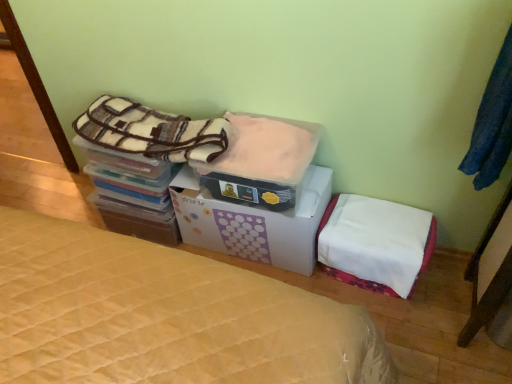
You are a GUI agent. You are given a task and a screenshot of the screen. Output one action in this format:
    pyautogui.click(x=<x>, y=<y>)
    Task: Click on the white cardboard box at center
    
    Given the screenshot: What is the action you would take?
    pyautogui.click(x=254, y=222)

What do you see at coordinates (151, 131) in the screenshot? I see `plush fleece blanket at upper left, which is counted as the first blanket, starting from the left` at bounding box center [151, 131].

This screenshot has width=512, height=384. In order to click on white cardboard box at center in this screenshot , I will do `click(254, 222)`.

Considering the sizes of objects white cardboard box at center and white fabric mattress at lower right in the image provided, who is smaller, white cardboard box at center or white fabric mattress at lower right?

white fabric mattress at lower right.

From a real-world perspective, which is physically above, white cardboard box at center or white fabric mattress at lower right?

white cardboard box at center, from a real-world perspective.

Considering the positions of points (190, 239) and (396, 211), is point (190, 239) closer to camera compared to point (396, 211)?

No, (190, 239) is behind (396, 211).

Would you say white fabric mattress at lower right is part of white cardboard box at center's contents?

That's incorrect, white fabric mattress at lower right is not inside white cardboard box at center.

From the image's perspective, would you say dark blue fabric at upper right is positioned over white cardboard box at center?

Yes, from the image's perspective, dark blue fabric at upper right is over white cardboard box at center.

From a real-world perspective, is dark blue fabric at upper right physically located above or below white cardboard box at center?

In terms of real-world spatial position, dark blue fabric at upper right is above white cardboard box at center.

Between dark blue fabric at upper right and white cardboard box at center, which one has smaller size?

Smaller between the two is dark blue fabric at upper right.

Does dark blue fabric at upper right appear on the right side of white cardboard box at center?

Correct, you'll find dark blue fabric at upper right to the right of white cardboard box at center.

Is white cardboard box at center in front of plush fleece blanket at upper left, the 2th blanket from the right?

No, it is not.

Considering the relative sizes of white cardboard box at center and plush fleece blanket at upper left, which is counted as the first blanket, starting from the left, in the image provided, is white cardboard box at center shorter than plush fleece blanket at upper left, which is counted as the first blanket, starting from the left,?

No, white cardboard box at center is not shorter than plush fleece blanket at upper left, which is counted as the first blanket, starting from the left.

From the image's perspective, is white cardboard box at center positioned above or below plush fleece blanket at upper left, which is counted as the first blanket, starting from the left?

Clearly, from the image's perspective, white cardboard box at center is below plush fleece blanket at upper left, which is counted as the first blanket, starting from the left.

Can you tell me how much white cardboard box at center and plush fleece blanket at upper left, the 2th blanket from the right, differ in facing direction?

There is a 0.000684-degree angle between the facing directions of white cardboard box at center and plush fleece blanket at upper left, the 2th blanket from the right.

Based on the photo, can you confirm if white cardboard box at center is smaller than dark blue fabric at upper right?

Actually, white cardboard box at center might be larger than dark blue fabric at upper right.

Based on the photo, considering the sizes of white cardboard box at center and dark blue fabric at upper right in the image, is white cardboard box at center taller or shorter than dark blue fabric at upper right?

white cardboard box at center is shorter than dark blue fabric at upper right.

From the image's perspective, between white cardboard box at center and dark blue fabric at upper right, which one is located above?

dark blue fabric at upper right, from the image's perspective.

You are a GUI agent. You are given a task and a screenshot of the screen. Output one action in this format:
    pyautogui.click(x=<x>, y=<y>)
    Task: Click on the clothing above the white cardboard box at center (from a real-world perspective)
    
    Given the screenshot: What is the action you would take?
    pyautogui.click(x=492, y=123)

Can you confirm if plush fleece blanket at upper left, which is counted as the first blanket, starting from the left, is bigger than white cardboard box at center?

No.

The image size is (512, 384). Find the location of `the 2nd blanket positioned above the white cardboard box at center (from the image's perspective)`. the 2nd blanket positioned above the white cardboard box at center (from the image's perspective) is located at coordinates (151, 131).

From the image's perspective, which one is positioned higher, plush fleece blanket at upper left, which is counted as the first blanket, starting from the left, or white cardboard box at center?

plush fleece blanket at upper left, which is counted as the first blanket, starting from the left.

Is plush fleece blanket at upper left, the 2th blanket from the right, facing towards fuzzy pink blanket at center, positioned as the first blanket in right-to-left order?

No, plush fleece blanket at upper left, the 2th blanket from the right, is not facing towards fuzzy pink blanket at center, positioned as the first blanket in right-to-left order.

Is plush fleece blanket at upper left, which is counted as the first blanket, starting from the left, in front of or behind fuzzy pink blanket at center, positioned as the first blanket in right-to-left order, in the image?

Clearly, plush fleece blanket at upper left, which is counted as the first blanket, starting from the left, is behind fuzzy pink blanket at center, positioned as the first blanket in right-to-left order.

From the picture: Who is shorter, plush fleece blanket at upper left, the 2th blanket from the right, or fuzzy pink blanket at center, positioned as the first blanket in right-to-left order?

Standing shorter between the two is plush fleece blanket at upper left, the 2th blanket from the right.

From the image's perspective, is plush fleece blanket at upper left, which is counted as the first blanket, starting from the left, above or below white fabric mattress at lower right?

Clearly, from the image's perspective, plush fleece blanket at upper left, which is counted as the first blanket, starting from the left, is above white fabric mattress at lower right.

Choose the correct answer: Is plush fleece blanket at upper left, which is counted as the first blanket, starting from the left, inside white fabric mattress at lower right or outside it?

plush fleece blanket at upper left, which is counted as the first blanket, starting from the left, exists outside the volume of white fabric mattress at lower right.

Is plush fleece blanket at upper left, which is counted as the first blanket, starting from the left, to the left of white fabric mattress at lower right from the viewer's perspective?

Yes.

Is plush fleece blanket at upper left, the 2th blanket from the right, positioned in front of white fabric mattress at lower right?

Yes, plush fleece blanket at upper left, the 2th blanket from the right, is closer to the viewer.

At what (x,y) coordinates should I click in order to perform the action: click on cardboard box in front of the white fabric mattress at lower right. Please return your answer as a coordinate pair (x, y). The image size is (512, 384). Looking at the image, I should click on (254, 222).

The height and width of the screenshot is (384, 512). What are the coordinates of `clothing above the white cardboard box at center (from the image's perspective)` in the screenshot? It's located at (492, 123).

Estimate the real-world distances between objects in this image. Which object is closer to plush fleece blanket at upper left, the 2th blanket from the right, dark blue fabric at upper right or fuzzy pink blanket at center, positioned as the first blanket in right-to-left order?

fuzzy pink blanket at center, positioned as the first blanket in right-to-left order, is closer to plush fleece blanket at upper left, the 2th blanket from the right.

When comparing their distances from white fabric mattress at lower right, does white cardboard box at center or dark blue fabric at upper right seem closer?

Among the two, white cardboard box at center is located nearer to white fabric mattress at lower right.

When comparing their distances from white fabric mattress at lower right, does white cardboard box at center or fuzzy pink blanket at center, positioned as the first blanket in right-to-left order, seem further?

fuzzy pink blanket at center, positioned as the first blanket in right-to-left order, lies further to white fabric mattress at lower right than the other object.

Which object lies nearer to the anchor point dark blue fabric at upper right, fuzzy pink blanket at center, which is the 2th blanket from left to right, or white cardboard box at center?

fuzzy pink blanket at center, which is the 2th blanket from left to right, is closer to dark blue fabric at upper right.

Based on their spatial positions, is dark blue fabric at upper right or white cardboard box at center further from white fabric mattress at lower right?

Based on the image, dark blue fabric at upper right appears to be further to white fabric mattress at lower right.

Considering their positions, is white fabric mattress at lower right positioned further to white cardboard box at center than fuzzy pink blanket at center, which is the 2th blanket from left to right?

Among the two, white fabric mattress at lower right is located further to white cardboard box at center.

Which object lies nearer to the anchor point white cardboard box at center, fuzzy pink blanket at center, which is the 2th blanket from left to right, or white fabric mattress at lower right?

Among the two, fuzzy pink blanket at center, which is the 2th blanket from left to right, is located nearer to white cardboard box at center.

When comparing their distances from plush fleece blanket at upper left, the 2th blanket from the right, does white cardboard box at center or dark blue fabric at upper right seem further?

The object further to plush fleece blanket at upper left, the 2th blanket from the right, is dark blue fabric at upper right.

The width and height of the screenshot is (512, 384). What are the coordinates of `mattress located between plush fleece blanket at upper left, the 2th blanket from the right, and dark blue fabric at upper right in the left-right direction` in the screenshot? It's located at (375, 243).

You are a GUI agent. You are given a task and a screenshot of the screen. Output one action in this format:
    pyautogui.click(x=<x>, y=<y>)
    Task: Click on the cardboard box between plush fleece blanket at upper left, which is counted as the first blanket, starting from the left, and fuzzy pink blanket at center, which is the 2th blanket from left to right, in the horizontal direction
    Image resolution: width=512 pixels, height=384 pixels.
    Given the screenshot: What is the action you would take?
    pyautogui.click(x=254, y=222)

At what (x,y) coordinates should I click in order to perform the action: click on blanket situated between white cardboard box at center and white fabric mattress at lower right from left to right. Please return your answer as a coordinate pair (x, y). The height and width of the screenshot is (384, 512). Looking at the image, I should click on (265, 149).

At what (x,y) coordinates should I click in order to perform the action: click on blanket between white cardboard box at center and dark blue fabric at upper right. Please return your answer as a coordinate pair (x, y). This screenshot has width=512, height=384. Looking at the image, I should click on (265, 149).